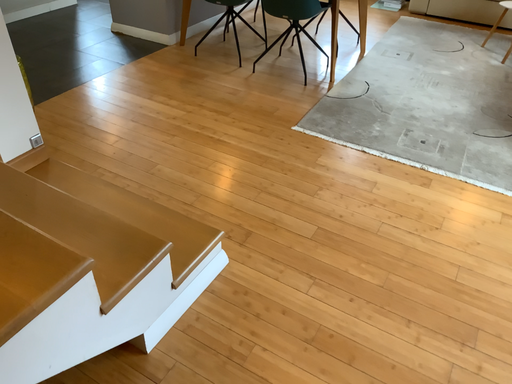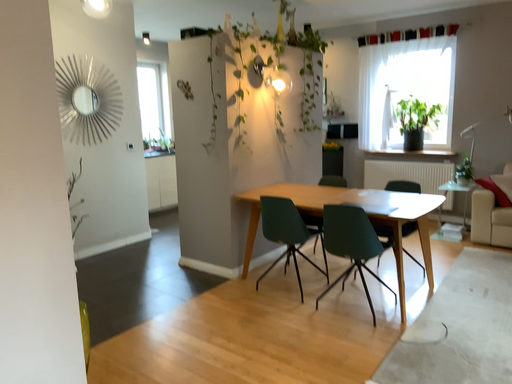
Question: How did the camera likely rotate when shooting the video?

Choices:
 (A) rotated upward
 (B) rotated downward

Answer: (A)